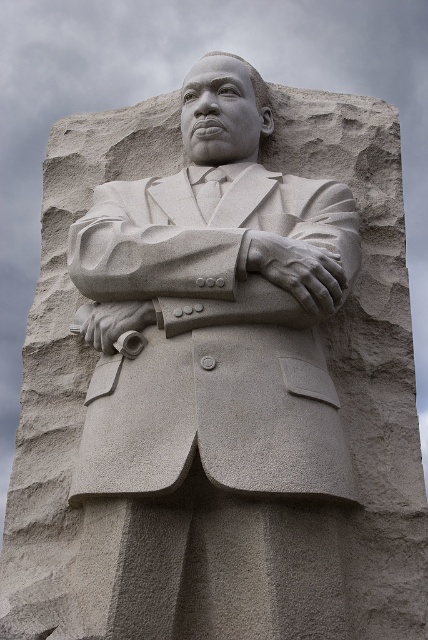
You are standing in front of the statue and want to take a photo of it. The statue is represented by the point at coordinates point (214, 310). To ensure the entire statue is in frame, where should you position your camera relative to the statue?

The gray stone statue at center is represented by point (214, 310). To capture the entire statue in the photo, position the camera directly in front and centered on the point (214, 310) to ensure the statue is fully framed.